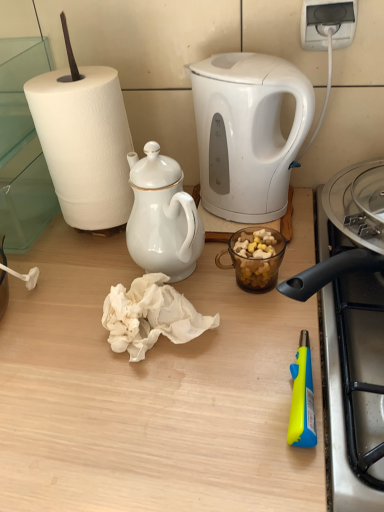
Question: Does white porcelain teapot at upper center have a lesser width compared to white glossy electric kettle at upper center?

Choices:
 (A) no
 (B) yes

Answer: (B)

Question: Does white porcelain teapot at upper center have a greater height compared to white glossy electric kettle at upper center?

Choices:
 (A) no
 (B) yes

Answer: (A)

Question: From a real-world perspective, does white porcelain teapot at upper center sit lower than white glossy electric kettle at upper center?

Choices:
 (A) no
 (B) yes

Answer: (B)

Question: Is white porcelain teapot at upper center not inside white glossy electric kettle at upper center?

Choices:
 (A) yes
 (B) no

Answer: (A)

Question: From the image's perspective, is white porcelain teapot at upper center located above white glossy electric kettle at upper center?

Choices:
 (A) no
 (B) yes

Answer: (A)

Question: Can you confirm if white porcelain teapot at upper center is shorter than white glossy electric kettle at upper center?

Choices:
 (A) no
 (B) yes

Answer: (B)

Question: Can you confirm if white crumpled paper towel at center is smaller than wooden table at center?

Choices:
 (A) yes
 (B) no

Answer: (A)

Question: From the image's perspective, is white crumpled paper towel at center over wooden table at center?

Choices:
 (A) no
 (B) yes

Answer: (B)

Question: Is white crumpled paper towel at center outside of wooden table at center?

Choices:
 (A) no
 (B) yes

Answer: (B)

Question: Is white crumpled paper towel at center closer to the viewer compared to wooden table at center?

Choices:
 (A) yes
 (B) no

Answer: (B)

Question: Can you confirm if white crumpled paper towel at center is positioned to the left of wooden table at center?

Choices:
 (A) yes
 (B) no

Answer: (B)

Question: Is wooden table at center surrounded by white crumpled paper towel at center?

Choices:
 (A) no
 (B) yes

Answer: (A)

Question: Considering the relative positions of white crumpled paper towel at center and white porcelain teapot at upper center in the image provided, is white crumpled paper towel at center to the left of white porcelain teapot at upper center from the viewer's perspective?

Choices:
 (A) yes
 (B) no

Answer: (A)